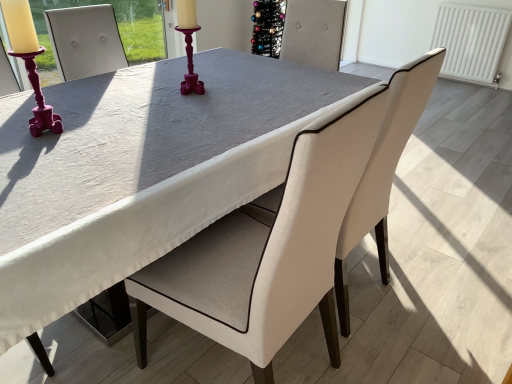
This screenshot has height=384, width=512. In order to click on free spot to the right of matte pink candlestick at left in this screenshot , I will do `click(97, 134)`.